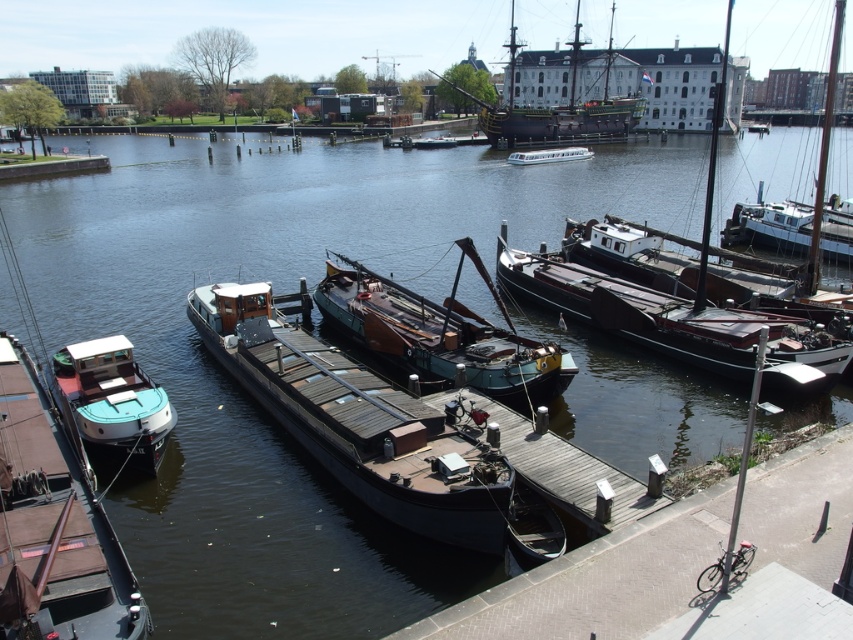
Question: In this image, where is wooden planks barge at center located relative to teal matte boat at left?

Choices:
 (A) below
 (B) above

Answer: (B)

Question: Can you confirm if teal matte boat at lower left is bigger than white glossy boat at center?

Choices:
 (A) yes
 (B) no

Answer: (B)

Question: Can you confirm if wooden planks barge at center is positioned below white wooden boat at right?

Choices:
 (A) no
 (B) yes

Answer: (B)

Question: Which point is closer to the camera?

Choices:
 (A) white wooden boat at right
 (B) wooden ship at upper center
 (C) teal wooden boat at center

Answer: (C)

Question: Which object appears farthest from the camera in this image?

Choices:
 (A) teal wooden boat at center
 (B) wooden planks barge at center
 (C) teal matte boat at left
 (D) wooden boat at center

Answer: (D)

Question: Among these points, which one is farthest from the camera?

Choices:
 (A) (500, 124)
 (B) (10, 358)
 (C) (321, 362)

Answer: (A)